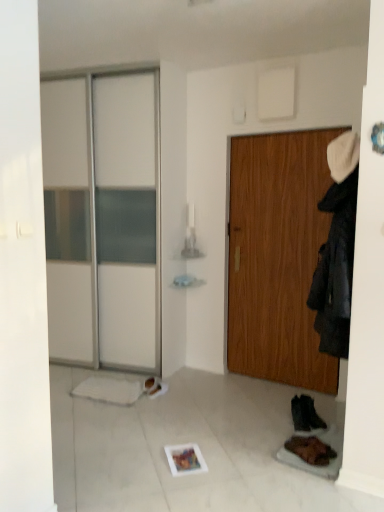
Based on the photo, measure the distance between dark gray fabric coat at right and camera.

The depth of dark gray fabric coat at right is 7.08 feet.

This screenshot has height=512, width=384. Describe the element at coordinates (335, 269) in the screenshot. I see `dark gray fabric coat at right` at that location.

This screenshot has height=512, width=384. What do you see at coordinates (310, 450) in the screenshot?
I see `brown leather boot at lower right, the first footwear viewed from the front` at bounding box center [310, 450].

Where is `black suede boot at lower right, arranged as the 2th footwear when viewed from the front`? The width and height of the screenshot is (384, 512). black suede boot at lower right, arranged as the 2th footwear when viewed from the front is located at coordinates (305, 414).

Locate an element on the screen. This screenshot has height=512, width=384. dark gray fabric coat at right is located at coordinates (335, 269).

Which is in front, point (292, 405) or point (348, 245)?

Positioned in front is point (348, 245).

Is dark gray fabric coat at right inside black suede boot at lower right, arranged as the 2th footwear when viewed from the front?

No, dark gray fabric coat at right is not surrounded by black suede boot at lower right, arranged as the 2th footwear when viewed from the front.

Could you tell me if black suede boot at lower right, arranged as the 2th footwear when viewed from the front, is facing dark gray fabric coat at right?

No, black suede boot at lower right, arranged as the 2th footwear when viewed from the front, is not facing towards dark gray fabric coat at right.

From the image's perspective, between black suede boot at lower right, arranged as the 2th footwear when viewed from the front, and dark gray fabric coat at right, who is located below?

black suede boot at lower right, arranged as the 2th footwear when viewed from the front, is shown below in the image.

Which is more distant, (346, 303) or (279, 320)?

The point (279, 320) is more distant.

How much distance is there between dark gray fabric coat at right and wooden door at center?

dark gray fabric coat at right and wooden door at center are 3.41 feet apart.

Is dark gray fabric coat at right aimed at wooden door at center?

No, dark gray fabric coat at right is not aimed at wooden door at center.

Which object is further away from the camera taking this photo, dark gray fabric coat at right or wooden door at center?

wooden door at center is more distant.

Considering the positions of objects brown leather boot at lower right, the 2th footwear in the back-to-front sequence, and black suede boot at lower right, positioned as the first footwear in back-to-front order, in the image provided, who is behind, brown leather boot at lower right, the 2th footwear in the back-to-front sequence, or black suede boot at lower right, positioned as the first footwear in back-to-front order,?

black suede boot at lower right, positioned as the first footwear in back-to-front order, is further from the camera.

Is brown leather boot at lower right, the first footwear viewed from the front, surrounding black suede boot at lower right, positioned as the first footwear in back-to-front order?

No.

Considering the relative sizes of brown leather boot at lower right, the 2th footwear in the back-to-front sequence, and black suede boot at lower right, arranged as the 2th footwear when viewed from the front, in the image provided, is brown leather boot at lower right, the 2th footwear in the back-to-front sequence, smaller than black suede boot at lower right, arranged as the 2th footwear when viewed from the front,?

Indeed, brown leather boot at lower right, the 2th footwear in the back-to-front sequence, has a smaller size compared to black suede boot at lower right, arranged as the 2th footwear when viewed from the front.

Considering the positions of objects brown leather boot at lower right, the first footwear viewed from the front, and black suede boot at lower right, arranged as the 2th footwear when viewed from the front, in the image provided, who is more to the left, brown leather boot at lower right, the first footwear viewed from the front, or black suede boot at lower right, arranged as the 2th footwear when viewed from the front,?

From the viewer's perspective, brown leather boot at lower right, the first footwear viewed from the front, appears more on the left side.

Is point (307, 419) positioned in front of point (300, 451)?

No, (307, 419) is further to viewer.

Does black suede boot at lower right, positioned as the first footwear in back-to-front order, turn towards brown leather boot at lower right, the first footwear viewed from the front?

No, black suede boot at lower right, positioned as the first footwear in back-to-front order, is not facing towards brown leather boot at lower right, the first footwear viewed from the front.

Relative to brown leather boot at lower right, the first footwear viewed from the front, is black suede boot at lower right, positioned as the first footwear in back-to-front order, in front or behind?

In the image, black suede boot at lower right, positioned as the first footwear in back-to-front order, appears behind brown leather boot at lower right, the first footwear viewed from the front.

From a real-world perspective, does wooden door at center stand above dark gray fabric coat at right?

Incorrect, from a real-world perspective, wooden door at center is lower than dark gray fabric coat at right.

Would you consider wooden door at center to be distant from dark gray fabric coat at right?

Yes, wooden door at center and dark gray fabric coat at right are located far from each other.

Which object is thinner, wooden door at center or dark gray fabric coat at right?

With smaller width is wooden door at center.

Consider the image. Does wooden door at center turn towards dark gray fabric coat at right?

No, wooden door at center is not aimed at dark gray fabric coat at right.

Is brown leather boot at lower right, the 2th footwear in the back-to-front sequence, at the back of wooden door at center?

No, wooden door at center's orientation is not away from brown leather boot at lower right, the 2th footwear in the back-to-front sequence.

Can we say wooden door at center lies outside brown leather boot at lower right, the 2th footwear in the back-to-front sequence?

Absolutely, wooden door at center is external to brown leather boot at lower right, the 2th footwear in the back-to-front sequence.

Are wooden door at center and brown leather boot at lower right, the first footwear viewed from the front, located far from each other?

Absolutely, wooden door at center is distant from brown leather boot at lower right, the first footwear viewed from the front.

I want to click on the 2nd footwear below the dark gray fabric coat at right (from a real-world perspective), so click(x=310, y=450).

From the image's perspective, is dark gray fabric coat at right on top of brown leather boot at lower right, the 2th footwear in the back-to-front sequence?

Yes, from the image's perspective, dark gray fabric coat at right is above brown leather boot at lower right, the 2th footwear in the back-to-front sequence.

Is dark gray fabric coat at right looking in the opposite direction of brown leather boot at lower right, the first footwear viewed from the front?

No, dark gray fabric coat at right is not facing the opposite direction of brown leather boot at lower right, the first footwear viewed from the front.

Between dark gray fabric coat at right and brown leather boot at lower right, the first footwear viewed from the front, which one is positioned behind?

brown leather boot at lower right, the first footwear viewed from the front, is further from the camera.

Where is `footwear that is the 1st one when counting downward from the dark gray fabric coat at right (from the image's perspective)`? This screenshot has height=512, width=384. footwear that is the 1st one when counting downward from the dark gray fabric coat at right (from the image's perspective) is located at coordinates click(305, 414).

In order to click on door below the dark gray fabric coat at right (from a real-world perspective) in this screenshot , I will do `click(277, 257)`.

Which object lies nearer to the anchor point black suede boot at lower right, positioned as the first footwear in back-to-front order, dark gray fabric coat at right or wooden door at center?

Among the two, wooden door at center is located nearer to black suede boot at lower right, positioned as the first footwear in back-to-front order.

From the image, which object appears to be nearer to dark gray fabric coat at right, wooden door at center or brown leather boot at lower right, the 2th footwear in the back-to-front sequence?

Based on the image, brown leather boot at lower right, the 2th footwear in the back-to-front sequence, appears to be nearer to dark gray fabric coat at right.

Looking at the image, which one is located further to brown leather boot at lower right, the 2th footwear in the back-to-front sequence, dark gray fabric coat at right or wooden door at center?

The object further to brown leather boot at lower right, the 2th footwear in the back-to-front sequence, is wooden door at center.

Based on their spatial positions, is dark gray fabric coat at right or black suede boot at lower right, positioned as the first footwear in back-to-front order, closer to brown leather boot at lower right, the first footwear viewed from the front?

Based on the image, black suede boot at lower right, positioned as the first footwear in back-to-front order, appears to be nearer to brown leather boot at lower right, the first footwear viewed from the front.

Looking at the image, which one is located closer to black suede boot at lower right, positioned as the first footwear in back-to-front order, brown leather boot at lower right, the 2th footwear in the back-to-front sequence, or dark gray fabric coat at right?

brown leather boot at lower right, the 2th footwear in the back-to-front sequence, lies closer to black suede boot at lower right, positioned as the first footwear in back-to-front order, than the other object.

Estimate the real-world distances between objects in this image. Which object is closer to dark gray fabric coat at right, wooden door at center or black suede boot at lower right, positioned as the first footwear in back-to-front order?

Based on the image, black suede boot at lower right, positioned as the first footwear in back-to-front order, appears to be nearer to dark gray fabric coat at right.

Consider the image. From the image, which object appears to be nearer to brown leather boot at lower right, the first footwear viewed from the front, black suede boot at lower right, positioned as the first footwear in back-to-front order, or wooden door at center?

Among the two, black suede boot at lower right, positioned as the first footwear in back-to-front order, is located nearer to brown leather boot at lower right, the first footwear viewed from the front.

Based on the photo, estimate the real-world distances between objects in this image. Which object is further from wooden door at center, brown leather boot at lower right, the first footwear viewed from the front, or black suede boot at lower right, arranged as the 2th footwear when viewed from the front?

brown leather boot at lower right, the first footwear viewed from the front, lies further to wooden door at center than the other object.

Image resolution: width=384 pixels, height=512 pixels. I want to click on footwear between dark gray fabric coat at right and brown leather boot at lower right, the 2th footwear in the back-to-front sequence, vertically, so click(x=305, y=414).

Image resolution: width=384 pixels, height=512 pixels. I want to click on door between dark gray fabric coat at right and brown leather boot at lower right, the first footwear viewed from the front, from top to bottom, so click(277, 257).

Where is `door between dark gray fabric coat at right and black suede boot at lower right, arranged as the 2th footwear when viewed from the front, in the up-down direction`? This screenshot has height=512, width=384. door between dark gray fabric coat at right and black suede boot at lower right, arranged as the 2th footwear when viewed from the front, in the up-down direction is located at coordinates (277, 257).

Image resolution: width=384 pixels, height=512 pixels. Find the location of `footwear between wooden door at center and brown leather boot at lower right, the 2th footwear in the back-to-front sequence, vertically`. footwear between wooden door at center and brown leather boot at lower right, the 2th footwear in the back-to-front sequence, vertically is located at coordinates (305, 414).